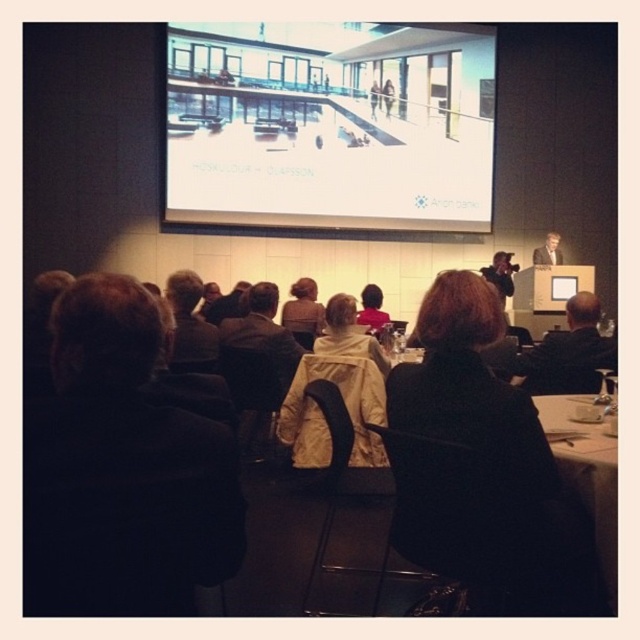
You are a photographer in the conference room and need to capture a clear image of the brown hair at center and the matte black camera at upper right. Which object will appear smaller in the photo?

The brown hair at center will appear smaller in the photo because it has a lesser width compared to the matte black camera at upper right.

In the conference room scene, there is a point marked at coordinates (122,472). Which object or feature in the image is located exactly at this point?

The dark brown hair at left is located at point 0.192, 0.738.

In the conference room scene, there are two people visible in the audience. One has dark brown hair at left and another has a smooth skin face at upper right. Which person is positioned more to the left side of the image?

The dark brown hair at left is positioned more to the left side of the image than the smooth skin face at upper right.